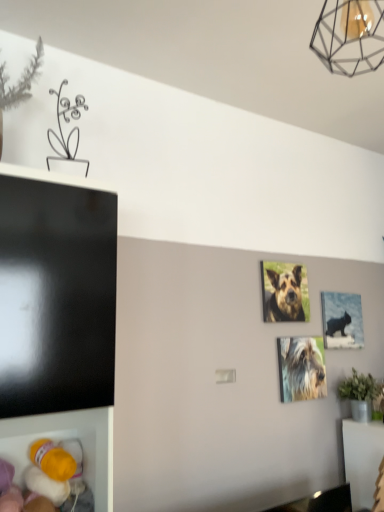
Question: Would you consider brown fur dog at center, marked as the 2th dog in a bottom-to-top arrangement, to be distant from metallic silver picture frame at center-right?

Choices:
 (A) no
 (B) yes

Answer: (A)

Question: Is brown fur dog at center, marked as the 2th dog in a bottom-to-top arrangement, positioned behind metallic silver picture frame at center-right?

Choices:
 (A) no
 (B) yes

Answer: (A)

Question: Does brown fur dog at center, positioned as the first dog in top-to-bottom order, have a greater width compared to metallic silver picture frame at center-right?

Choices:
 (A) no
 (B) yes

Answer: (A)

Question: From the image's perspective, would you say brown fur dog at center, marked as the 2th dog in a bottom-to-top arrangement, is positioned over metallic silver picture frame at center-right?

Choices:
 (A) no
 (B) yes

Answer: (B)

Question: Can we say brown fur dog at center, positioned as the first dog in top-to-bottom order, lies outside metallic silver picture frame at center-right?

Choices:
 (A) no
 (B) yes

Answer: (B)

Question: Considering the relative sizes of brown fur dog at center, marked as the 2th dog in a bottom-to-top arrangement, and metallic silver picture frame at center-right in the image provided, is brown fur dog at center, marked as the 2th dog in a bottom-to-top arrangement, taller than metallic silver picture frame at center-right?

Choices:
 (A) no
 (B) yes

Answer: (A)

Question: Is metallic silver picture frame at center-right far away from metallic wireframe lamp at upper right?

Choices:
 (A) no
 (B) yes

Answer: (B)

Question: Does metallic silver picture frame at center-right turn towards metallic wireframe lamp at upper right?

Choices:
 (A) no
 (B) yes

Answer: (A)

Question: Does metallic silver picture frame at center-right lie in front of metallic wireframe lamp at upper right?

Choices:
 (A) yes
 (B) no

Answer: (B)

Question: Is metallic wireframe lamp at upper right at the back of metallic silver picture frame at center-right?

Choices:
 (A) yes
 (B) no

Answer: (B)

Question: Is metallic wireframe lamp at upper right a part of metallic silver picture frame at center-right?

Choices:
 (A) yes
 (B) no

Answer: (B)

Question: Can you confirm if metallic silver picture frame at center-right is shorter than metallic wireframe lamp at upper right?

Choices:
 (A) no
 (B) yes

Answer: (A)

Question: Would you say metallic silver picture frame at center-right is part of metallic wireframe lamp at upper right's contents?

Choices:
 (A) no
 (B) yes

Answer: (A)